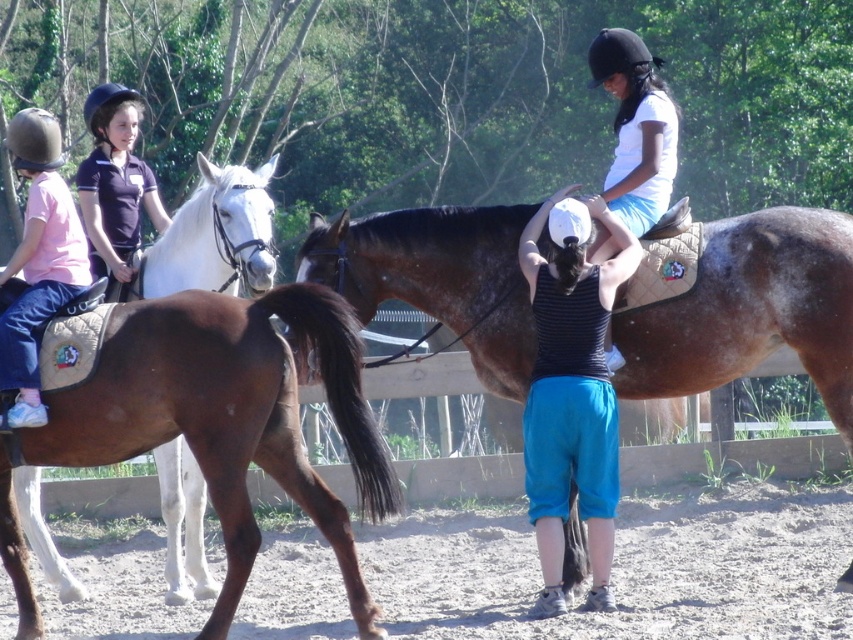
Question: Is white glossy horse at left further to the viewer compared to matte black helmet at upper left?

Choices:
 (A) no
 (B) yes

Answer: (A)

Question: Which object appears farthest from the camera in this image?

Choices:
 (A) matte pink shirt at left
 (B) brown quilted saddle at center

Answer: (B)

Question: Considering the relative positions of brown leather saddle at lower left and matte pink shirt at left in the image provided, where is brown leather saddle at lower left located with respect to matte pink shirt at left?

Choices:
 (A) left
 (B) right

Answer: (B)

Question: Which object is closer to the camera taking this photo?

Choices:
 (A) matte pink shirt at left
 (B) white glossy horse at left
 (C) matte black helmet at upper left
 (D) brown quilted saddle at center

Answer: (A)

Question: In this image, where is brown leather saddle at lower left located relative to matte black helmet at upper left?

Choices:
 (A) left
 (B) right

Answer: (B)

Question: Which of the following is the farthest from the observer?

Choices:
 (A) matte pink shirt at left
 (B) matte black helmet at upper left
 (C) dirt track at lower center
 (D) brown quilted saddle at center

Answer: (B)